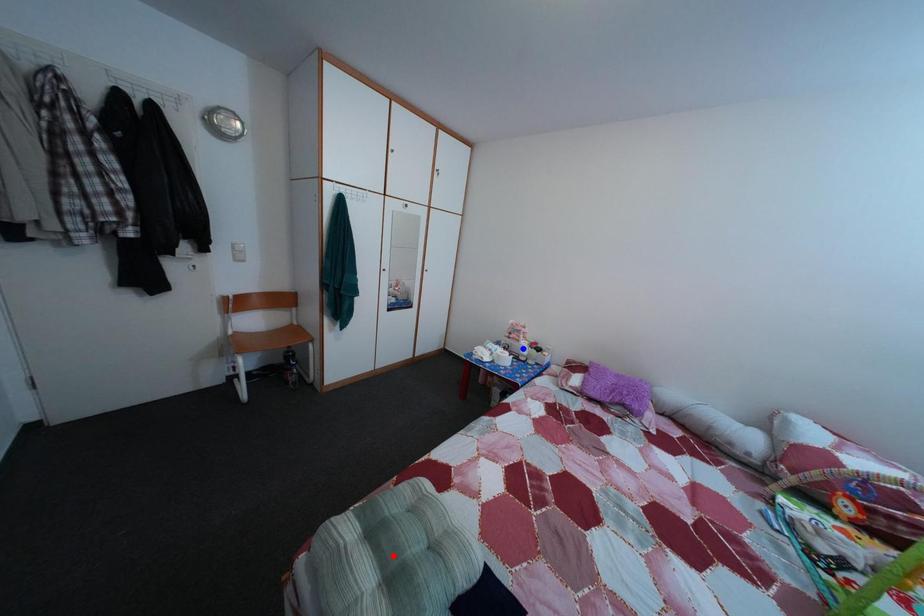
Question: Two points are marked on the image. Which point is closer to the camera?

Choices:
 (A) Blue point is closer.
 (B) Red point is closer.

Answer: (B)